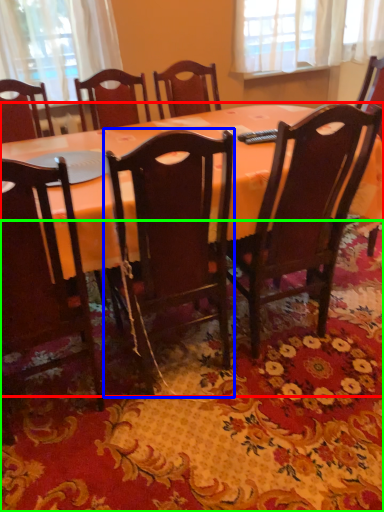
Question: Which object is the closest to the table (highlighted by a red box)? Choose among these: chair (highlighted by a blue box) or mat (highlighted by a green box).

Choices:
 (A) chair
 (B) mat

Answer: (A)